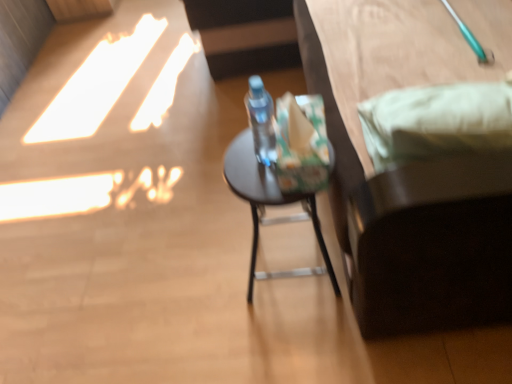
Question: Is dark brown wooden bed at right positioned with its back to matte black stool at center?

Choices:
 (A) no
 (B) yes

Answer: (A)

Question: Is dark brown wooden bed at right at the left side of matte black stool at center?

Choices:
 (A) yes
 (B) no

Answer: (B)

Question: Considering the relative sizes of dark brown wooden bed at right and matte black stool at center in the image provided, is dark brown wooden bed at right smaller than matte black stool at center?

Choices:
 (A) yes
 (B) no

Answer: (B)

Question: Is dark brown wooden bed at right wider than matte black stool at center?

Choices:
 (A) yes
 (B) no

Answer: (A)

Question: From the image's perspective, would you say dark brown wooden bed at right is shown under matte black stool at center?

Choices:
 (A) no
 (B) yes

Answer: (A)

Question: Can matte black stool at center be found inside dark brown wooden bed at right?

Choices:
 (A) yes
 (B) no

Answer: (B)

Question: Is matte black stool at center next to dark brown wooden bed at right and touching it?

Choices:
 (A) yes
 (B) no

Answer: (B)

Question: Is matte black stool at center outside dark brown wooden bed at right?

Choices:
 (A) yes
 (B) no

Answer: (A)

Question: Is dark brown wooden bed at right at the back of matte black stool at center?

Choices:
 (A) yes
 (B) no

Answer: (A)

Question: Does matte black stool at center appear on the left side of dark brown wooden bed at right?

Choices:
 (A) no
 (B) yes

Answer: (B)

Question: Is matte black stool at center positioned behind dark brown wooden bed at right?

Choices:
 (A) yes
 (B) no

Answer: (A)

Question: Would you say dark brown wooden bed at right is part of matte black stool at center's contents?

Choices:
 (A) no
 (B) yes

Answer: (A)

Question: Does matte black stool at center have a smaller size compared to transparent plastic bottle at center?

Choices:
 (A) no
 (B) yes

Answer: (A)